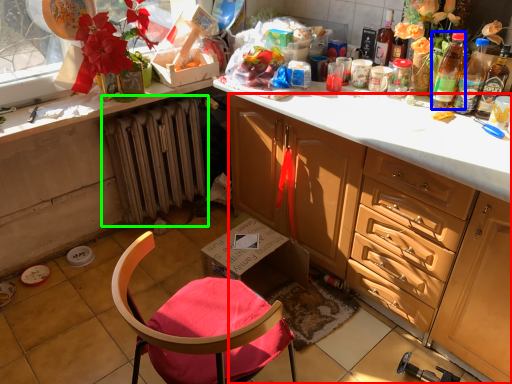
Question: Which object is the closest to the cabinetry (highlighted by a red box)? Choose among these: bottle (highlighted by a blue box) or radiator (highlighted by a green box).

Choices:
 (A) bottle
 (B) radiator

Answer: (A)